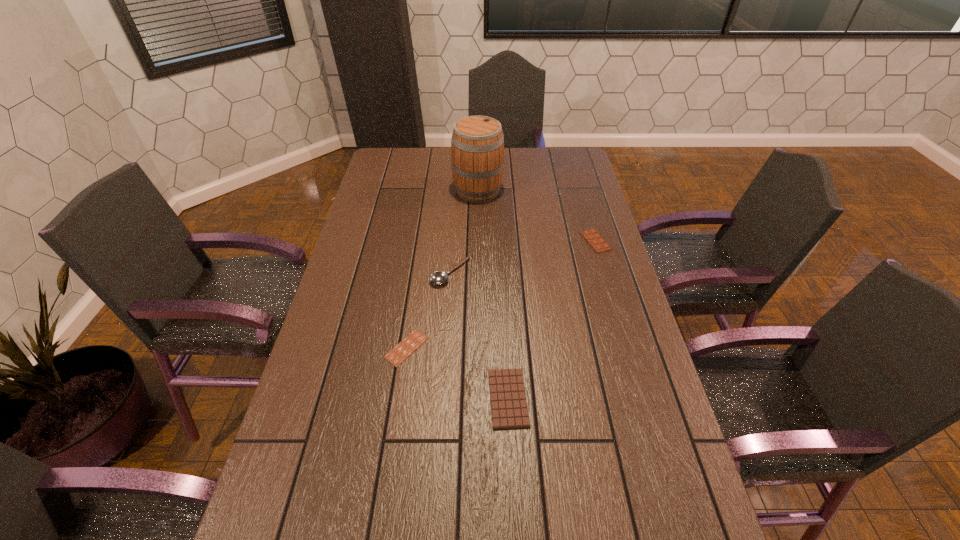
Image resolution: width=960 pixels, height=540 pixels. What are the coordinates of `free region located on the right of the tallest object` in the screenshot? It's located at (581, 190).

I want to click on vacant space located on the back of the third farthest object, so tap(454, 228).

The image size is (960, 540). Identify the location of vacant space located 0.390m on the back of the second farthest object. (575, 172).

You are a GUI agent. You are given a task and a screenshot of the screen. Output one action in this format:
    pyautogui.click(x=<x>, y=<y>)
    Task: Click on the vacant position located 0.220m on the left of the second tallest chocolate bar
    
    Given the screenshot: What is the action you would take?
    pyautogui.click(x=399, y=398)

Identify the location of free space located 0.160m on the back of the shortest object. This screenshot has width=960, height=540. (416, 289).

The height and width of the screenshot is (540, 960). What are the coordinates of `object present at the right edge` in the screenshot? It's located at (593, 238).

Where is `free space at the far edge`? Image resolution: width=960 pixels, height=540 pixels. free space at the far edge is located at coordinates (517, 164).

The image size is (960, 540). Identify the location of free space at the left edge of the desktop. (352, 380).

You are a GUI agent. You are given a task and a screenshot of the screen. Output one action in this format:
    pyautogui.click(x=<x>, y=<y>)
    Task: Click on the free space at the right edge of the desktop
    
    Given the screenshot: What is the action you would take?
    pyautogui.click(x=605, y=370)

At what (x,y) coordinates should I click in order to perform the action: click on blank space at the far right corner of the desktop. Please return your answer as a coordinate pair (x, y). Looking at the image, I should click on (564, 152).